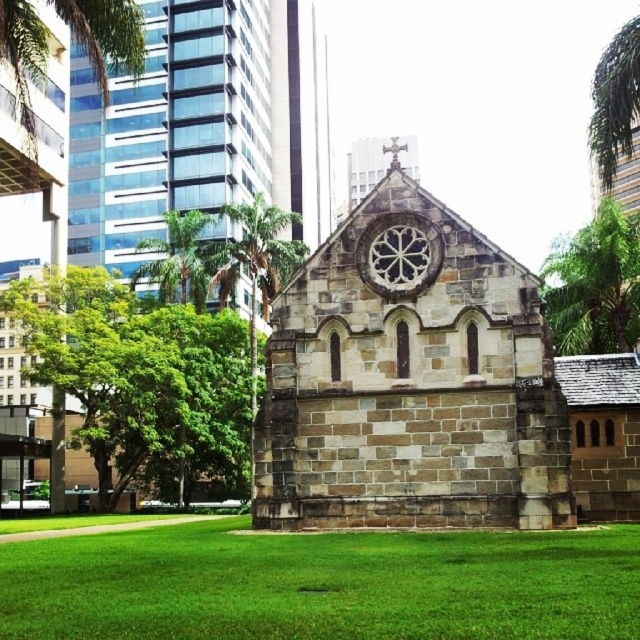
Question: Which point appears farthest from the camera in this image?

Choices:
 (A) (579, 248)
 (B) (611, 596)
 (C) (236, 278)

Answer: (C)

Question: Does green grass at lower center appear on the right side of green leafy palm tree at upper left?

Choices:
 (A) no
 (B) yes

Answer: (B)

Question: Among these points, which one is nearest to the camera?

Choices:
 (A) (596, 102)
 (B) (586, 275)
 (C) (88, 44)

Answer: (C)

Question: Does brown stone chapel at center appear over green leafy palm tree at right?

Choices:
 (A) yes
 (B) no

Answer: (B)

Question: Which of the following is the closest to the observer?

Choices:
 (A) green leafy palm tree at upper left
 (B) green leafy tree at upper left
 (C) brown stone chapel at center

Answer: (C)

Question: Does green leafy tree at upper right have a larger size compared to green leafy palm tree at upper left?

Choices:
 (A) yes
 (B) no

Answer: (A)